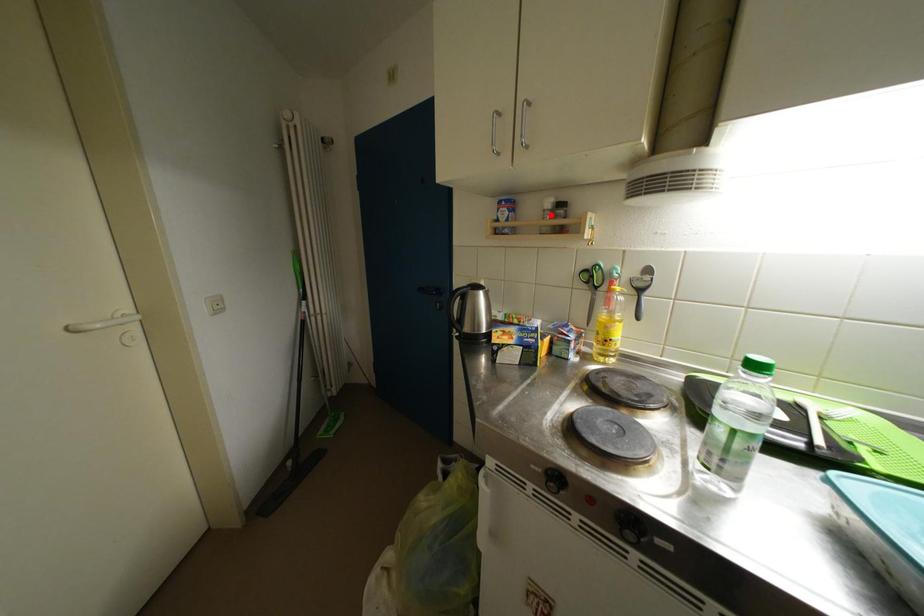
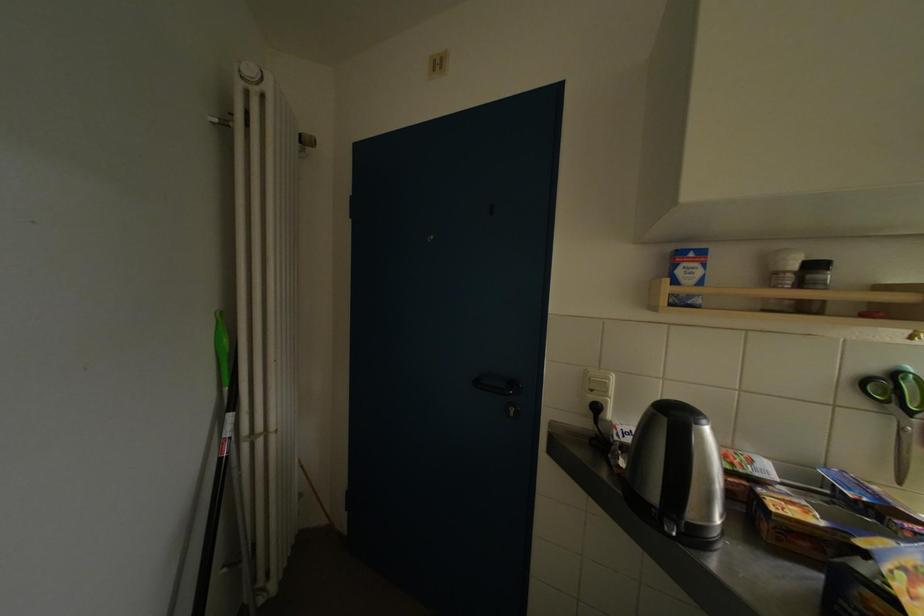
Locate, in the second image, the point that corresponds to the highlighted location in the first image.

(784, 277)